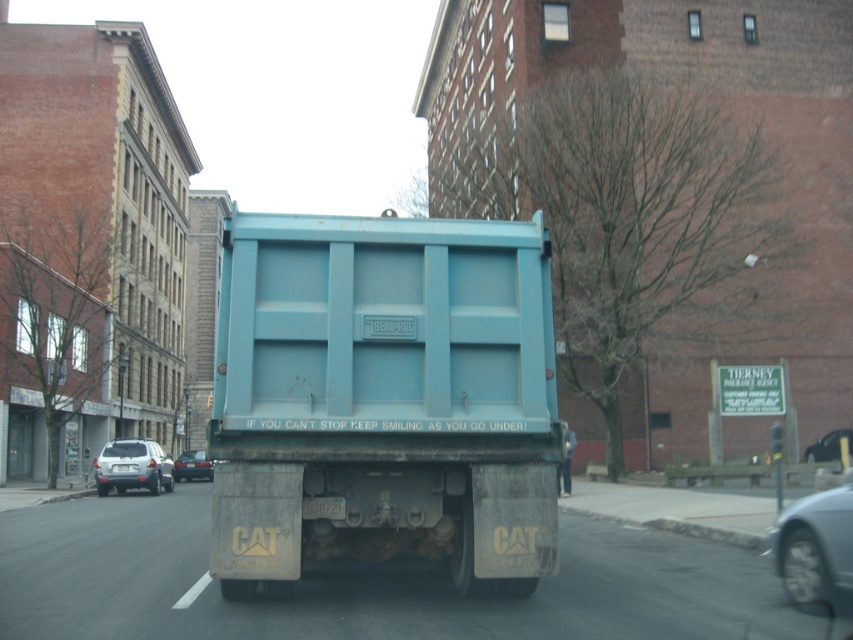
Question: Which object is positioned farthest from the shiny black car at center?

Choices:
 (A) white plastic license plate at center
 (B) shiny black sedan at center

Answer: (B)

Question: Can you confirm if satin silver suv at lower left is positioned to the right of shiny black sedan at center?

Choices:
 (A) yes
 (B) no

Answer: (A)

Question: Does blue matte dump truck at center have a greater width compared to satin silver suv at lower left?

Choices:
 (A) no
 (B) yes

Answer: (A)

Question: Estimate the real-world distances between objects in this image. Which object is closer to the satin silver suv at lower left?

Choices:
 (A) metallic silver car at lower right
 (B) blue matte dump truck at center
 (C) white plastic license plate at center

Answer: (C)

Question: Which of the following is the closest to the observer?

Choices:
 (A) (207, 477)
 (B) (115, 467)
 (C) (805, 538)

Answer: (C)

Question: Can you confirm if shiny black car at center is wider than white plastic license plate at center?

Choices:
 (A) no
 (B) yes

Answer: (B)